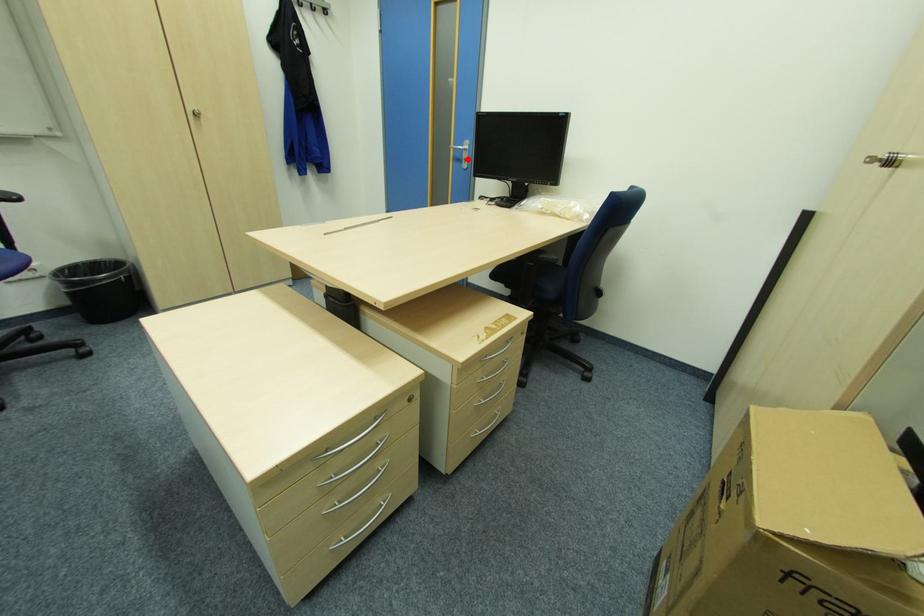
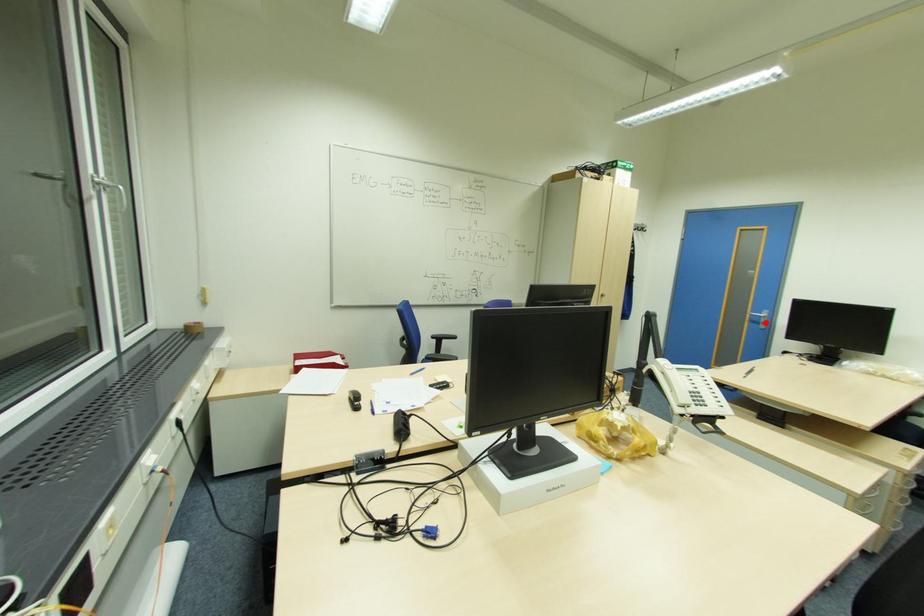
I am providing you with two images of the same scene from different viewpoints. A red point is marked on the first image and another point is marked on the second image. Is the red point in image1 aligned with the point shown in image2?

Yes